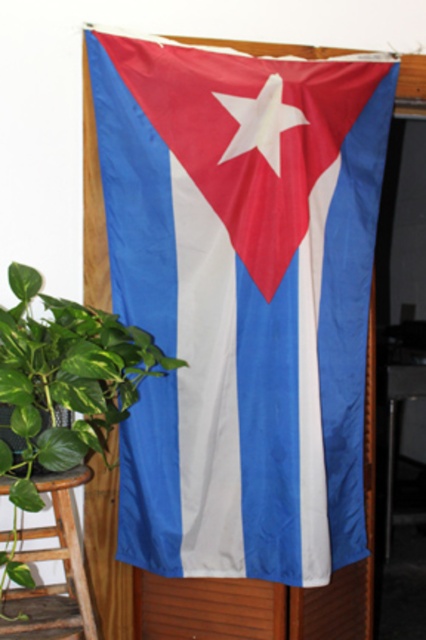
Question: Which object is the closest to the textured fabric flag at center?

Choices:
 (A) wooden stool at lower left
 (B) white matte star at center
 (C) wooden at left
 (D) green leafy plant at left

Answer: (B)

Question: Can you confirm if wooden at left is positioned to the left of white matte star at center?

Choices:
 (A) yes
 (B) no

Answer: (A)

Question: Does textured fabric flag at center appear on the left side of white matte star at center?

Choices:
 (A) no
 (B) yes

Answer: (B)

Question: From the image, what is the correct spatial relationship of green leafy plant at left in relation to wooden at left?

Choices:
 (A) left
 (B) right

Answer: (B)

Question: Which point is closer to the camera taking this photo?

Choices:
 (A) (281, 97)
 (B) (155, 61)
 (C) (6, 552)

Answer: (C)

Question: Which of the following is the closest to the observer?

Choices:
 (A) (284, 355)
 (B) (391, 396)
 (C) (279, 118)
 (D) (14, 419)

Answer: (D)